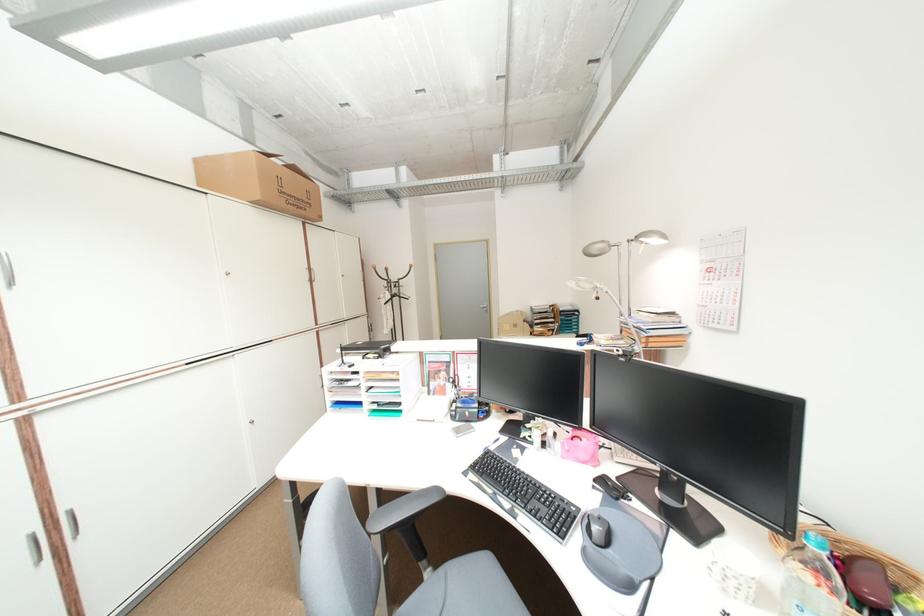
Where would you lift the wicker basket? Please return your answer as a coordinate pair (x, y).

(857, 559)